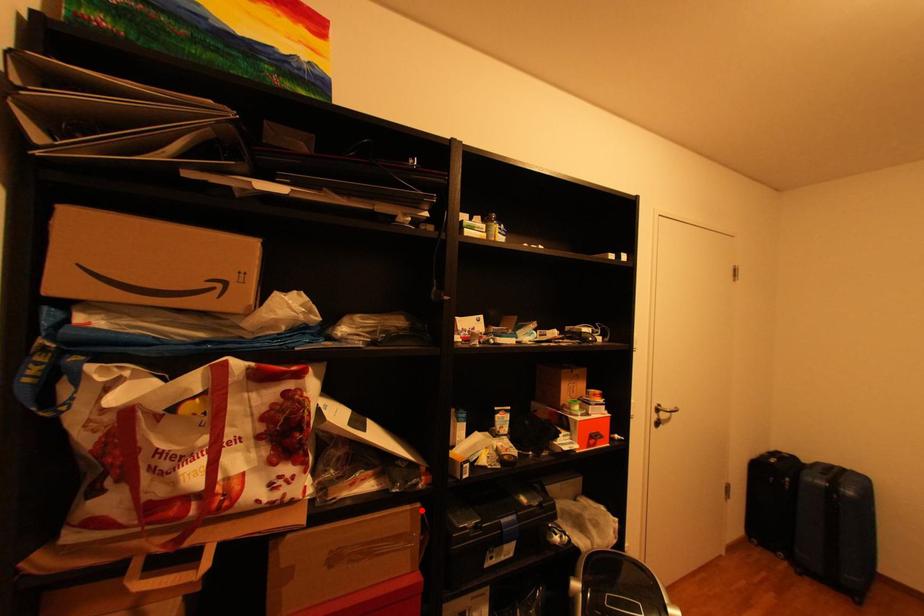
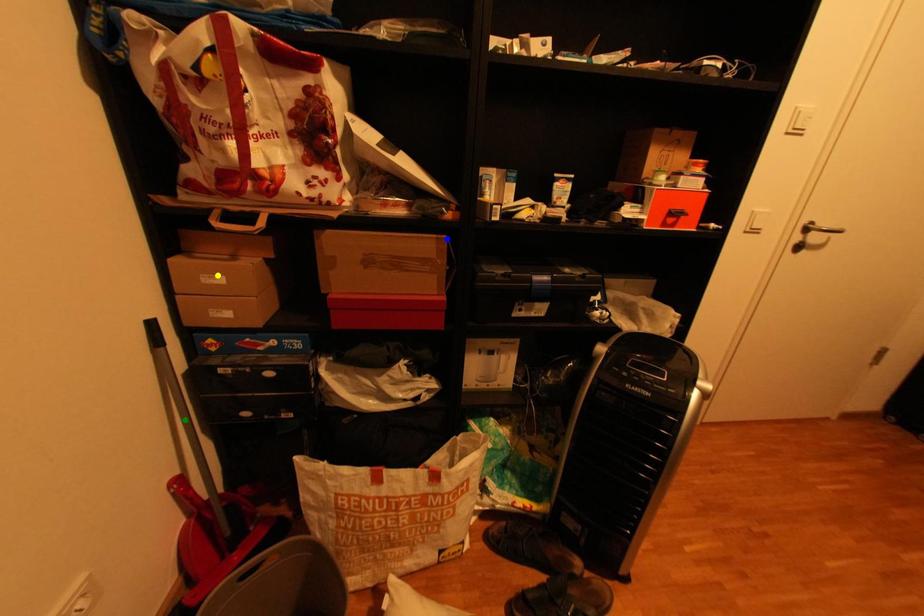
Question: I am providing you with two images of the same scene from different viewpoints. A red point is marked on the first image. You are given multiple points on the second image. Which mark in image 2 goes with the point in image 1?

Choices:
 (A) green point
 (B) yellow point
 (C) blue point

Answer: (C)